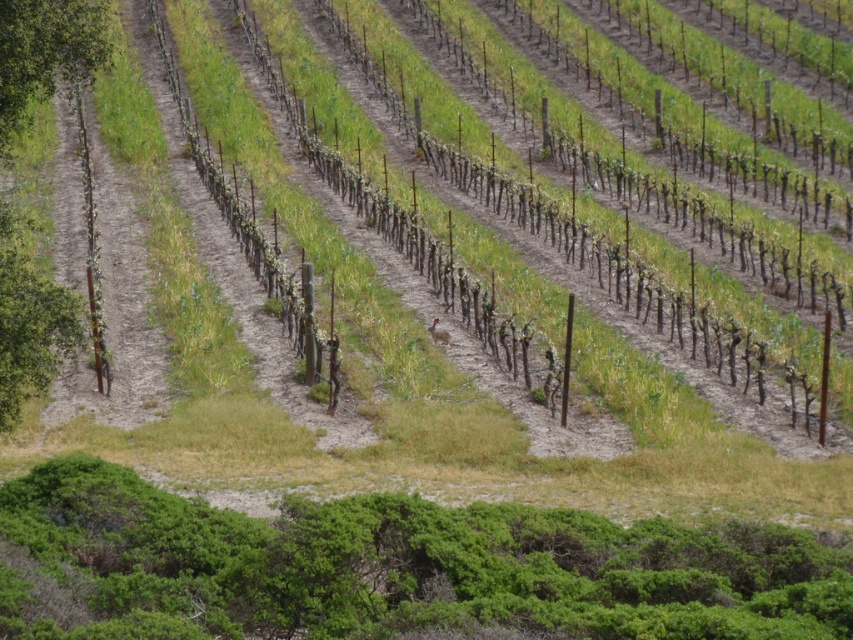
You are standing at the center of the vineyard and see the smooth brown tree trunk at left. Based on its coordinates, can you determine if it is located to the left or right side of the vineyard?

The smooth brown tree trunk at left is located at coordinate point 0.503 on the x axis and 0.035 on the y axis. Since the x coordinate is 0.503, which is slightly to the right of the center point of 0.5, the tree trunk is positioned just to the right of the center of the vineyard.

You are standing in the vineyard and notice two trees in the distance. One is a smooth brown tree trunk at left and the other is a green leafy tree at upper left. Which tree is closer to you?

The smooth brown tree trunk at left is closer to you because it is in front of the green leafy tree at upper left.